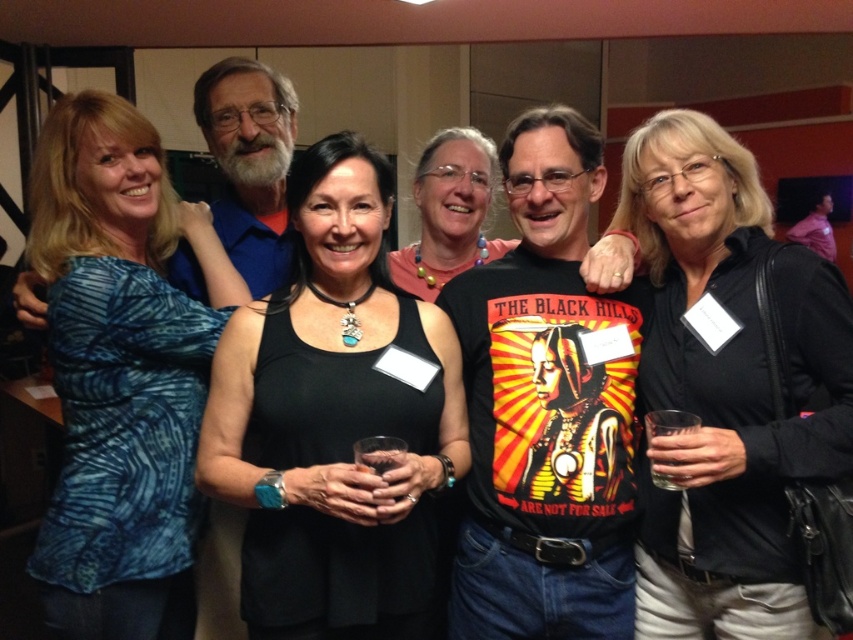
Is blue printed shirt at left taller than shiny black t-shirt at center?

Yes, blue printed shirt at left is taller than shiny black t-shirt at center.

In the scene shown: Does blue printed shirt at left have a lesser height compared to shiny black t-shirt at center?

No.

Is point (109, 212) behind point (631, 502)?

That is True.

This screenshot has width=853, height=640. I want to click on blue printed shirt at left, so click(x=120, y=371).

Which of these two, shiny black t-shirt at center or matte black tank top at center, stands shorter?

matte black tank top at center

From the picture: Can you confirm if shiny black t-shirt at center is positioned above matte black tank top at center?

No, shiny black t-shirt at center is not above matte black tank top at center.

Is point (624, 321) more distant than point (426, 244)?

That is False.

Image resolution: width=853 pixels, height=640 pixels. What are the coordinates of `shiny black t-shirt at center` in the screenshot? It's located at (544, 410).

Between point (305, 305) and point (200, 253), which one is positioned in front?

Point (305, 305) is more forward.

Between black matte tank top at center and blue printed shirt at left, which one appears on the left side from the viewer's perspective?

From the viewer's perspective, blue printed shirt at left appears more on the left side.

Is point (212, 448) positioned before point (146, 406)?

Yes, it is in front of point (146, 406).

In order to click on black matte tank top at center in this screenshot , I will do `click(335, 422)`.